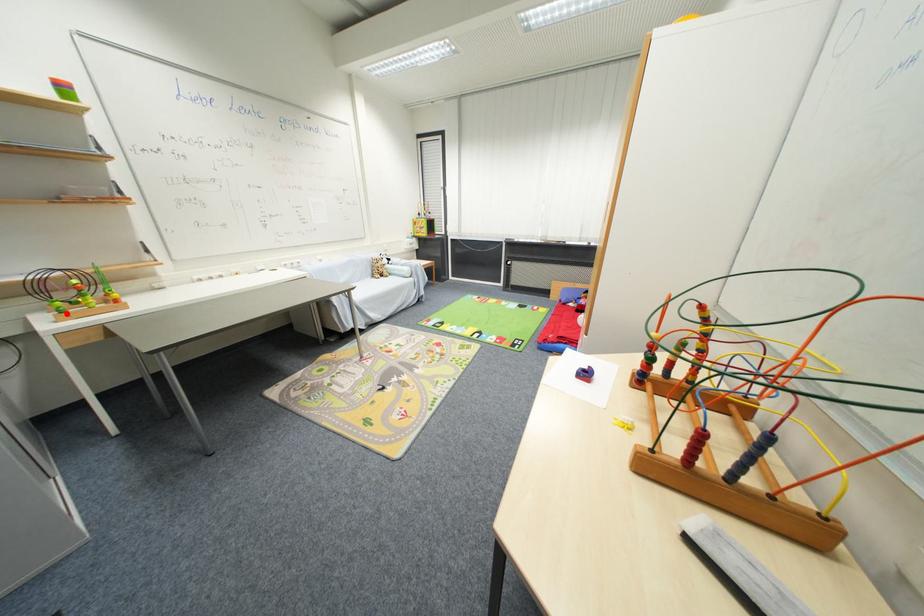
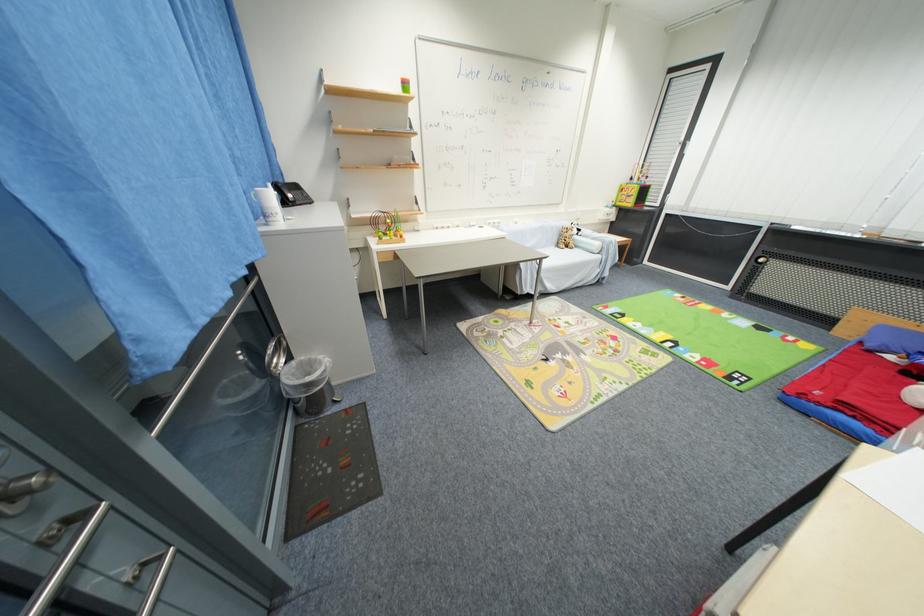
Question: A red point is marked in image1. In image2, is the corresponding 3D point closer to the camera or farther? Reply with the corresponding letter.

Choices:
 (A) The corresponding 3D point is closer.
 (B) The corresponding 3D point is farther.

Answer: (A)